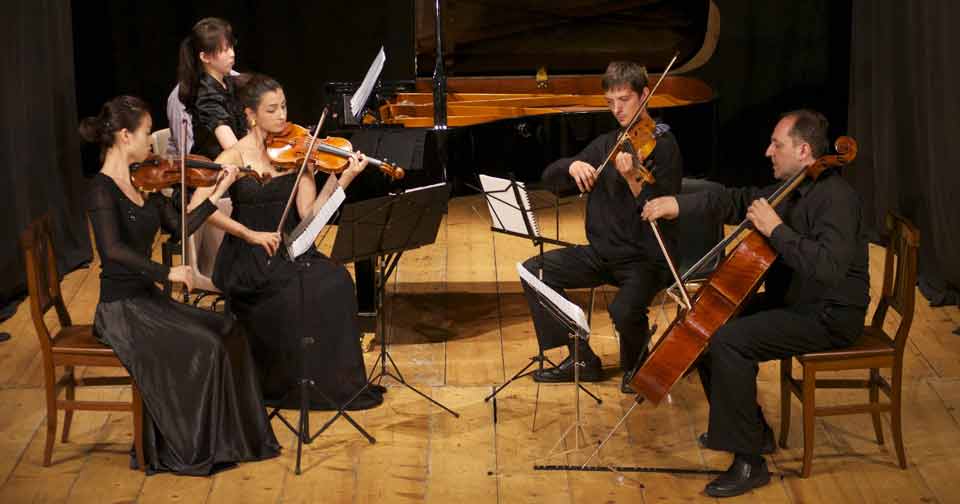
Find the location of a particular element. wooden floor is located at coordinates (457, 461).